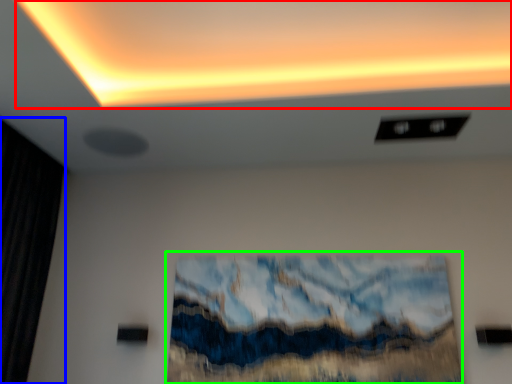
Question: Based on their relative distances, which object is farther from glow (highlighted by a red box)? Choose from curtain (highlighted by a blue box) and oil painting (highlighted by a green box).

Choices:
 (A) curtain
 (B) oil painting

Answer: (A)